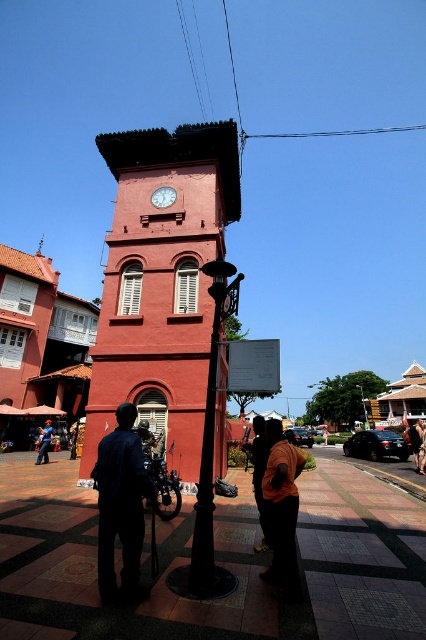
You are standing in front of the red clock tower and notice both the black wrought iron lamp post at center and the matte red clock at center. Which object is nearer to you?

The black wrought iron lamp post at center is closer to the viewer than the matte red clock at center.

You are a city planner reviewing the layout of the public square in front of the red clock tower. You need to install a new bench that must be placed between the black wrought iron lamp post at center and the dark brown leather jacket at lower right. Given that the bench requires at least 1.2 meters of space to fit, can the available space between these two objects accommodate it?

The black wrought iron lamp post at center has a smaller size compared to dark brown leather jacket at lower right. However, the description does not provide specific measurements of the distance between them, so it is unclear if the space is sufficient for the bench requiring 1.2 meters. Additional information about the distance between the two objects is needed to determine feasibility.